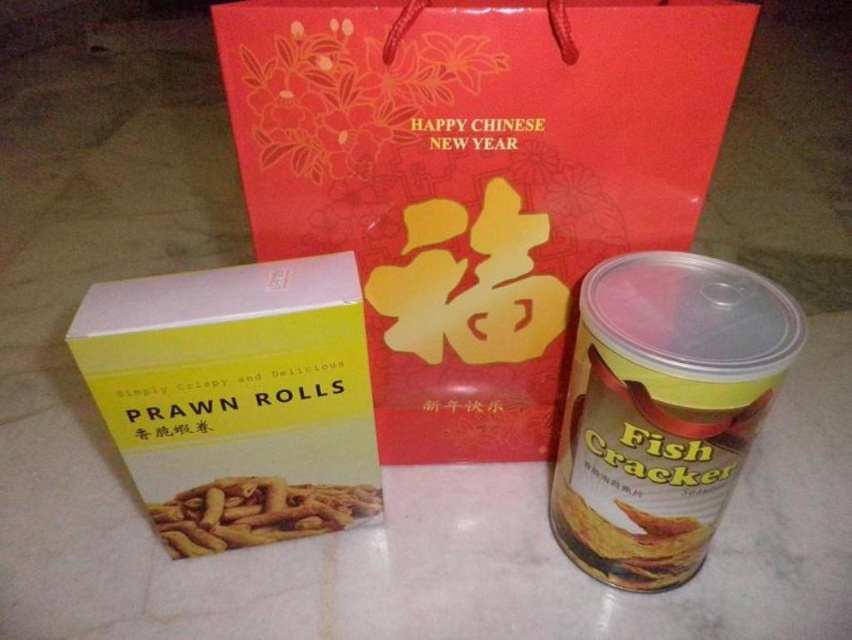
You are a delivery person who needs to place a 12 inch long package between the red paper bag at center and the yellow matte prawn rolls at center. Can the package fit in the space between them?

The distance between the red paper bag at center and the yellow matte prawn rolls at center is 13.77 inches, so the 12 inch long package can fit in the space between them since it is shorter than the available distance.

Where is the red paper bag at center located?

The red paper bag at center is located at point [475,179].

You are organizing items on a shelf and need to place the red paper bag at center and the yellow matte prawn rolls at left. If the shelf has limited space, which item should you place first to maximize shelf usage?

The red paper bag at center is wider than the yellow matte prawn rolls at left, so you should place the red paper bag at center first to accommodate its larger width and then fit the yellow matte prawn rolls at left alongside it.